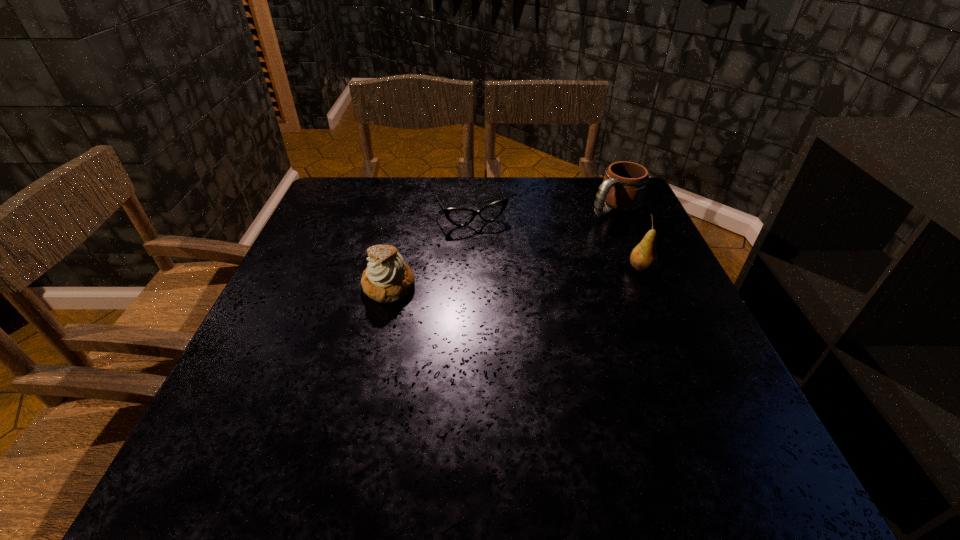
Find the location of a particular element. This screenshot has height=540, width=960. vacant area that lies between the leftmost object and the tallest object is located at coordinates (515, 278).

Locate an element on the screen. The height and width of the screenshot is (540, 960). vacant area that lies between the spectacles and the pastry is located at coordinates (430, 251).

Locate an element on the screen. vacant space that is in between the mug and the leftmost object is located at coordinates (502, 247).

In order to click on free point between the pear and the mug in this screenshot , I will do `click(628, 238)`.

The height and width of the screenshot is (540, 960). I want to click on object that is the third closest to the second object from left to right, so click(643, 258).

Select which object is the third closest to the tallest object. Please provide its 2D coordinates. Your answer should be formatted as a tuple, i.e. [(x, y)], where the tuple contains the x and y coordinates of a point satisfying the conditions above.

[(387, 279)]

Locate an element on the screen. The image size is (960, 540). vacant area that satisfies the following two spatial constraints: 1. on the back side of the shortest object; 2. on the right side of the pastry is located at coordinates pyautogui.click(x=405, y=215).

Locate an element on the screen. vacant region that satisfies the following two spatial constraints: 1. on the front side of the spectacles; 2. on the right side of the tallest object is located at coordinates click(470, 268).